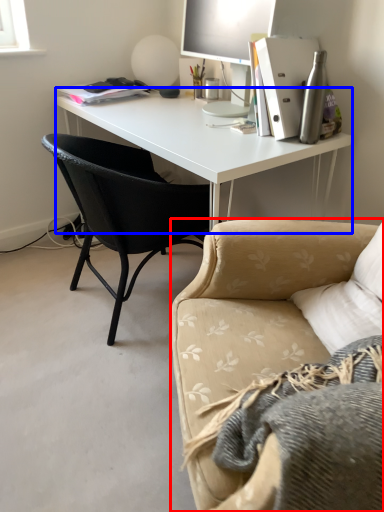
Question: Among these objects, which one is farthest to the camera, studio couch (highlighted by a red box) or desk (highlighted by a blue box)?

Choices:
 (A) studio couch
 (B) desk

Answer: (B)